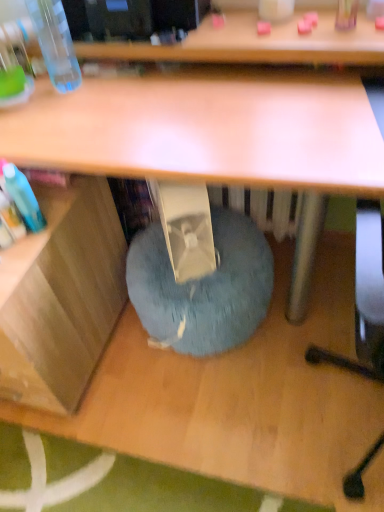
Question: Is blue fuzzy bean bag at lower center next to transparent plastic bottle at upper left and touching it?

Choices:
 (A) no
 (B) yes

Answer: (A)

Question: Is blue fuzzy bean bag at lower center thinner than transparent plastic bottle at upper left?

Choices:
 (A) no
 (B) yes

Answer: (A)

Question: Is blue fuzzy bean bag at lower center completely or partially outside of transparent plastic bottle at upper left?

Choices:
 (A) yes
 (B) no

Answer: (A)

Question: Does blue fuzzy bean bag at lower center come in front of transparent plastic bottle at upper left?

Choices:
 (A) yes
 (B) no

Answer: (B)

Question: Is transparent plastic bottle at upper left located within blue fuzzy bean bag at lower center?

Choices:
 (A) no
 (B) yes

Answer: (A)

Question: From the image's perspective, is blue fuzzy bean bag at lower center beneath transparent plastic bottle at upper left?

Choices:
 (A) no
 (B) yes

Answer: (B)

Question: Is blue fuzzy bean bag at lower center positioned beyond the bounds of wooden at left?

Choices:
 (A) no
 (B) yes

Answer: (B)

Question: Is the surface of blue fuzzy bean bag at lower center in direct contact with wooden at left?

Choices:
 (A) yes
 (B) no

Answer: (B)

Question: From the image's perspective, does blue fuzzy bean bag at lower center appear higher than wooden at left?

Choices:
 (A) no
 (B) yes

Answer: (B)

Question: Considering the relative sizes of blue fuzzy bean bag at lower center and wooden at left in the image provided, is blue fuzzy bean bag at lower center bigger than wooden at left?

Choices:
 (A) yes
 (B) no

Answer: (B)

Question: Considering the relative sizes of blue fuzzy bean bag at lower center and wooden at left in the image provided, is blue fuzzy bean bag at lower center smaller than wooden at left?

Choices:
 (A) yes
 (B) no

Answer: (A)

Question: From a real-world perspective, does blue fuzzy bean bag at lower center sit lower than wooden at left?

Choices:
 (A) no
 (B) yes

Answer: (B)

Question: Is transparent plastic bottle at upper left positioned far away from blue fuzzy bean bag at lower center?

Choices:
 (A) yes
 (B) no

Answer: (B)